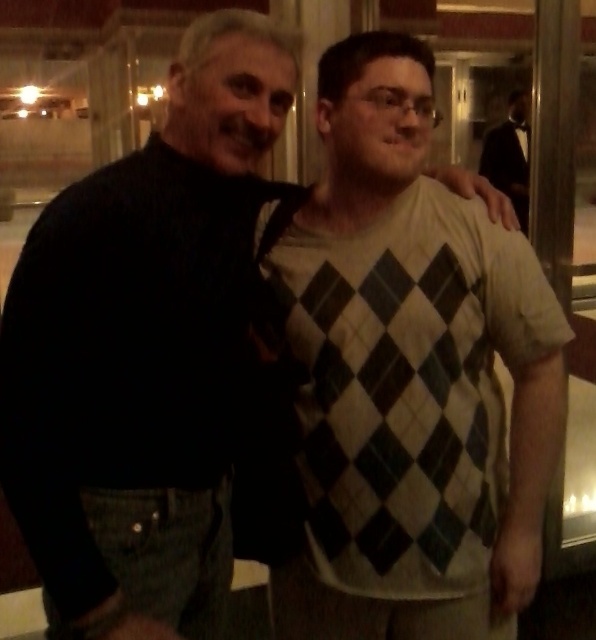
Question: Can you confirm if argyle sweater at center is bigger than black tuxedo at right?

Choices:
 (A) yes
 (B) no

Answer: (B)

Question: Which point is farther to the camera?

Choices:
 (A) argyle sweater at center
 (B) black tuxedo at right

Answer: (B)

Question: Can you confirm if argyle sweater at center is smaller than black tuxedo at right?

Choices:
 (A) no
 (B) yes

Answer: (B)

Question: Among these objects, which one is farthest from the camera?

Choices:
 (A) black tuxedo at right
 (B) argyle sweater at center

Answer: (A)

Question: Is argyle sweater at center in front of black tuxedo at right?

Choices:
 (A) yes
 (B) no

Answer: (A)